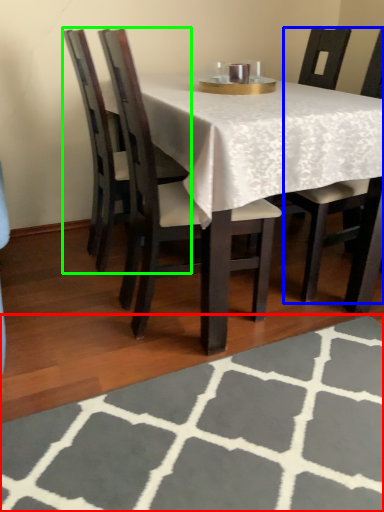
Question: Estimate the real-world distances between objects in this image. Which object is farther from place mat (highlighted by a red box), chair (highlighted by a blue box) or chair (highlighted by a green box)?

Choices:
 (A) chair
 (B) chair

Answer: (B)